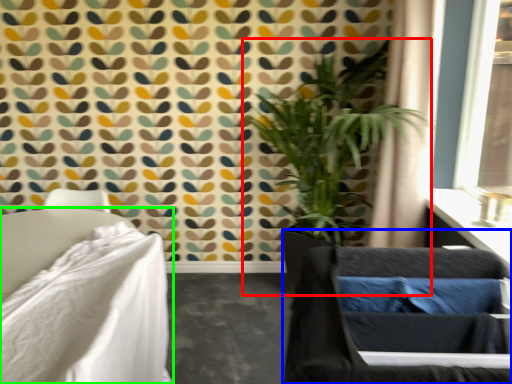
Question: Considering the real-world distances, which object is closest to houseplant (highlighted by a red box)? swivel chair (highlighted by a blue box) or furniture (highlighted by a green box).

Choices:
 (A) swivel chair
 (B) furniture

Answer: (B)